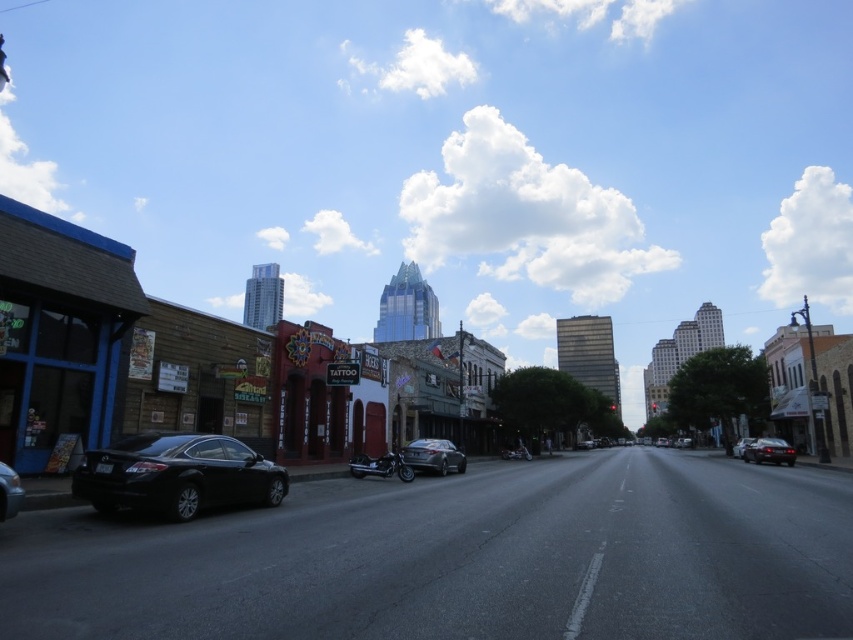
Which is below, satin silver sedan at center or shiny black sedan at lower left?

satin silver sedan at center is below.

Can you confirm if satin silver sedan at center is positioned to the left of shiny black sedan at lower left?

No, satin silver sedan at center is not to the left of shiny black sedan at lower left.

Image resolution: width=853 pixels, height=640 pixels. Find the location of `satin silver sedan at center`. satin silver sedan at center is located at coordinates (433, 456).

Does black matte car at left appear on the right side of black matte sedan at center-right?

Incorrect, black matte car at left is not on the right side of black matte sedan at center-right.

Can you confirm if black matte car at left is positioned to the left of black matte sedan at center-right?

Indeed, black matte car at left is positioned on the left side of black matte sedan at center-right.

Image resolution: width=853 pixels, height=640 pixels. What are the coordinates of `black matte car at left` in the screenshot? It's located at (177, 476).

Between point (413, 464) and point (784, 440), which one is positioned in front?

Point (413, 464) is in front.

Does point (457, 464) come behind point (750, 458)?

No, it is not.

Find the location of `satin silver sedan at center`. satin silver sedan at center is located at coordinates (433, 456).